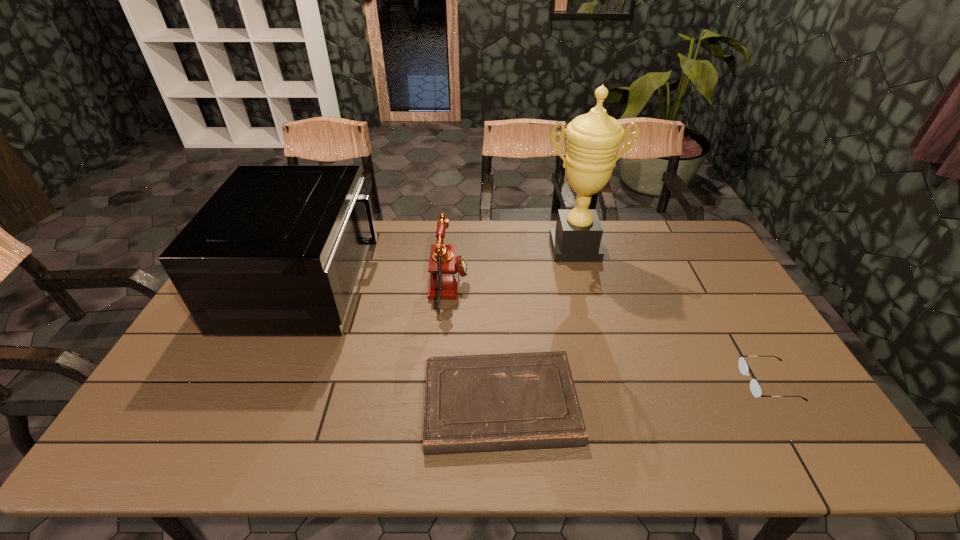
Locate an element on the screen. The height and width of the screenshot is (540, 960). empty location between the trophy cup and the spectacles is located at coordinates (672, 315).

Identify the location of free space between the rightmost object and the leftmost object. Image resolution: width=960 pixels, height=540 pixels. (538, 333).

The width and height of the screenshot is (960, 540). Find the location of `the third closest object to the microwave_oven`. the third closest object to the microwave_oven is located at coordinates (593, 140).

Where is `object that is the closest to the spectacles`? object that is the closest to the spectacles is located at coordinates tap(515, 401).

You are a GUI agent. You are given a task and a screenshot of the screen. Output one action in this format:
    pyautogui.click(x=<x>, y=<y>)
    Task: Click on the free point that satisfies the following two spatial constraints: 1. on the front-facing side of the fourth shortest object; 2. on the back side of the paperback book
    Image resolution: width=960 pixels, height=540 pixels.
    Given the screenshot: What is the action you would take?
    pyautogui.click(x=254, y=404)

Find the location of a particular element. The image size is (960, 540). vacant space that satisfies the following two spatial constraints: 1. at the front of the tallest object with handles; 2. on the dial of the third tallest object is located at coordinates (586, 288).

Identify the location of free space in the image that satisfies the following two spatial constraints: 1. on the dial of the paperback book; 2. on the left side of the telephone. The height and width of the screenshot is (540, 960). (440, 404).

In order to click on free space that satisfies the following two spatial constraints: 1. on the dial of the paperback book; 2. on the right side of the telephone in this screenshot , I will do `click(440, 404)`.

Image resolution: width=960 pixels, height=540 pixels. Identify the location of free space that satisfies the following two spatial constraints: 1. on the dial of the third tallest object; 2. on the back side of the paperback book. (440, 404).

The width and height of the screenshot is (960, 540). I want to click on free space that satisfies the following two spatial constraints: 1. at the front of the trophy cup with handles; 2. on the front-facing side of the microwave_oven, so click(x=585, y=284).